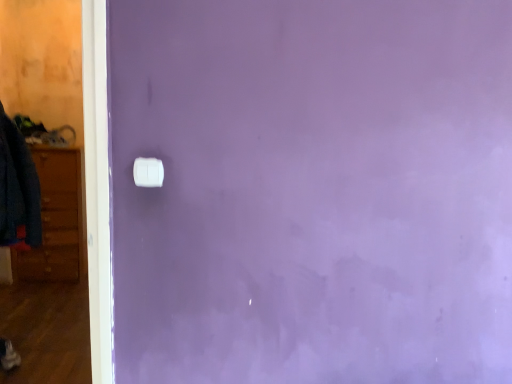
Describe the element at coordinates (17, 187) in the screenshot. I see `denim jacket at left` at that location.

Where is `denim jacket at left`? Image resolution: width=512 pixels, height=384 pixels. denim jacket at left is located at coordinates (17, 187).

At what (x,y) coordinates should I click in order to perform the action: click on white plastic light switch at center. Please return your answer as a coordinate pair (x, y). Looking at the image, I should click on point(148,172).

This screenshot has height=384, width=512. Describe the element at coordinates (148, 172) in the screenshot. I see `white plastic light switch at center` at that location.

Locate an element on the screen. This screenshot has width=512, height=384. denim jacket at left is located at coordinates (17, 187).

Which object is positioned more to the right, white plastic light switch at center or denim jacket at left?

Positioned to the right is white plastic light switch at center.

Does white plastic light switch at center come in front of denim jacket at left?

Yes, the depth of white plastic light switch at center is less than that of denim jacket at left.

Which is behind, point (139, 167) or point (12, 127)?

Positioned behind is point (12, 127).

From the image's perspective, which one is positioned lower, white plastic light switch at center or denim jacket at left?

From the image's view, white plastic light switch at center is below.

From a real-world perspective, is white plastic light switch at center positioned above or below denim jacket at left?

From a real-world perspective, white plastic light switch at center is physically above denim jacket at left.

Considering the relative sizes of white plastic light switch at center and denim jacket at left in the image provided, is white plastic light switch at center thinner than denim jacket at left?

Yes, white plastic light switch at center is thinner than denim jacket at left.

In terms of height, does white plastic light switch at center look taller or shorter compared to denim jacket at left?

Clearly, white plastic light switch at center is shorter compared to denim jacket at left.

Does white plastic light switch at center have a smaller size compared to denim jacket at left?

Yes.

Do you think white plastic light switch at center is within denim jacket at left, or outside of it?

white plastic light switch at center lies outside denim jacket at left.

Would you say white plastic light switch at center is a long distance from denim jacket at left?

That's right, there is a large distance between white plastic light switch at center and denim jacket at left.

Is white plastic light switch at center aimed at denim jacket at left?

No, white plastic light switch at center is not turned towards denim jacket at left.

Measure the distance between white plastic light switch at center and denim jacket at left.

They are 4.39 feet apart.

In order to click on light switch in front of the denim jacket at left in this screenshot , I will do `click(148, 172)`.

Is denim jacket at left at the left side of white plastic light switch at center?

Yes.

Considering the positions of objects denim jacket at left and white plastic light switch at center in the image provided, who is behind, denim jacket at left or white plastic light switch at center?

denim jacket at left.

Which point is more distant from viewer, (18, 216) or (159, 168)?

The point (18, 216) is farther.

From the image's perspective, is denim jacket at left above white plastic light switch at center?

Indeed, from the image's perspective, denim jacket at left is shown above white plastic light switch at center.

From a real-world perspective, is denim jacket at left on top of white plastic light switch at center?

No, from a real-world perspective, denim jacket at left is not on top of white plastic light switch at center.

Between denim jacket at left and white plastic light switch at center, which one has smaller width?

Thinner between the two is white plastic light switch at center.

Can you confirm if denim jacket at left is shorter than white plastic light switch at center?

Incorrect, the height of denim jacket at left does not fall short of that of white plastic light switch at center.

Considering the sizes of objects denim jacket at left and white plastic light switch at center in the image provided, who is smaller, denim jacket at left or white plastic light switch at center?

Smaller between the two is white plastic light switch at center.

Would you say white plastic light switch at center is part of denim jacket at left's contents?

No, white plastic light switch at center is not surrounded by denim jacket at left.

In the scene shown: Is denim jacket at left placed right next to white plastic light switch at center?

denim jacket at left and white plastic light switch at center are clearly separated.

Looking at this image, is denim jacket at left oriented towards white plastic light switch at center?

No, denim jacket at left is not facing towards white plastic light switch at center.

How different are the orientations of denim jacket at left and white plastic light switch at center in degrees?

They differ by 94.8 degrees in their facing directions.

This screenshot has height=384, width=512. Identify the location of light switch below the denim jacket at left (from the image's perspective). (148, 172).

Find the location of a particular element. The height and width of the screenshot is (384, 512). clothing that is above the white plastic light switch at center (from the image's perspective) is located at coordinates (x=17, y=187).

Identify the location of clothing behind the white plastic light switch at center. This screenshot has width=512, height=384. (17, 187).